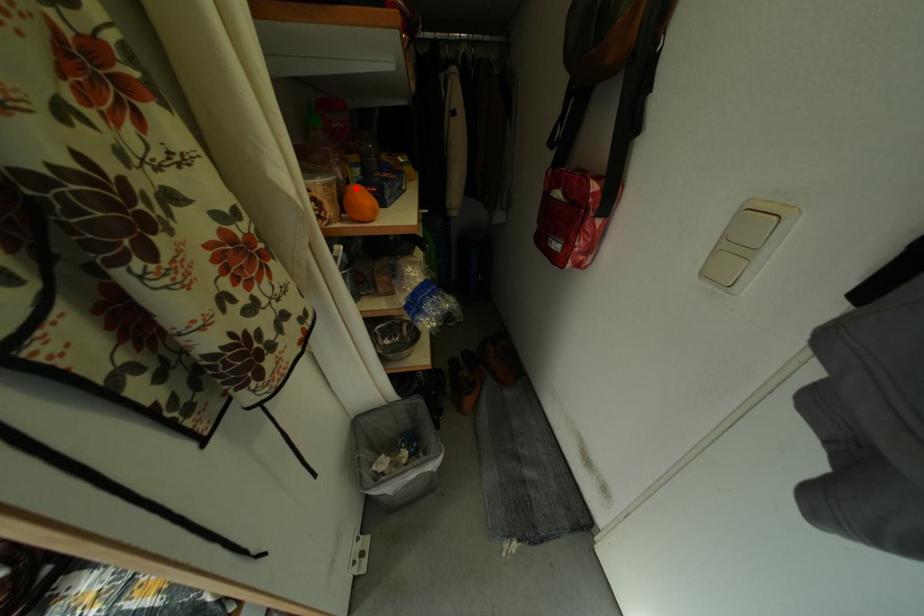
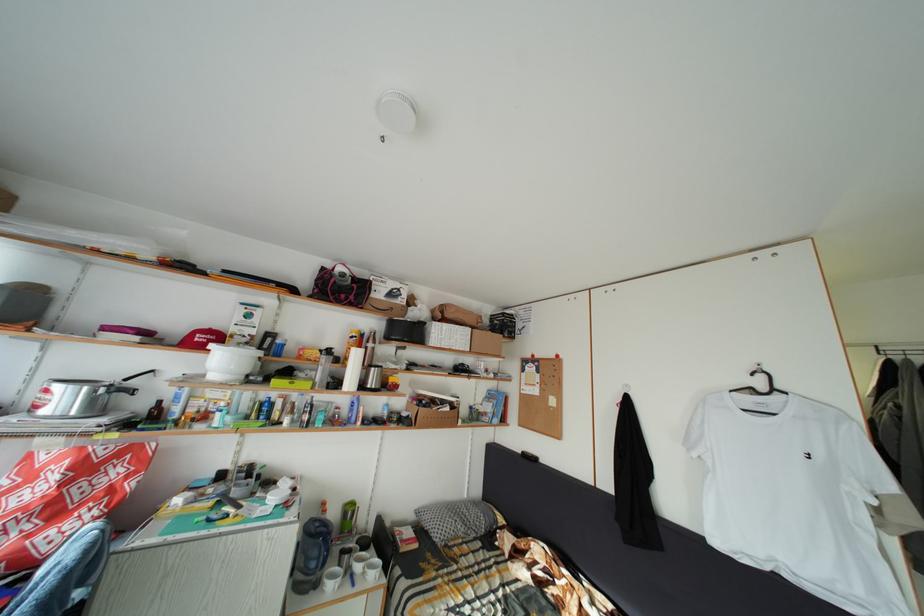
Question: I am providing you with two images of the same scene from different viewpoints. A red point is marked on the first image. Can you still see the location of the red point in image 2?

Choices:
 (A) Yes
 (B) No

Answer: (B)